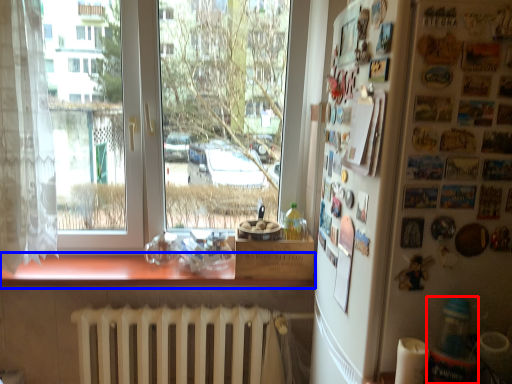
Question: Which object appears farthest to the camera in this image, bottle (highlighted by a red box) or counter top (highlighted by a blue box)?

Choices:
 (A) bottle
 (B) counter top

Answer: (B)